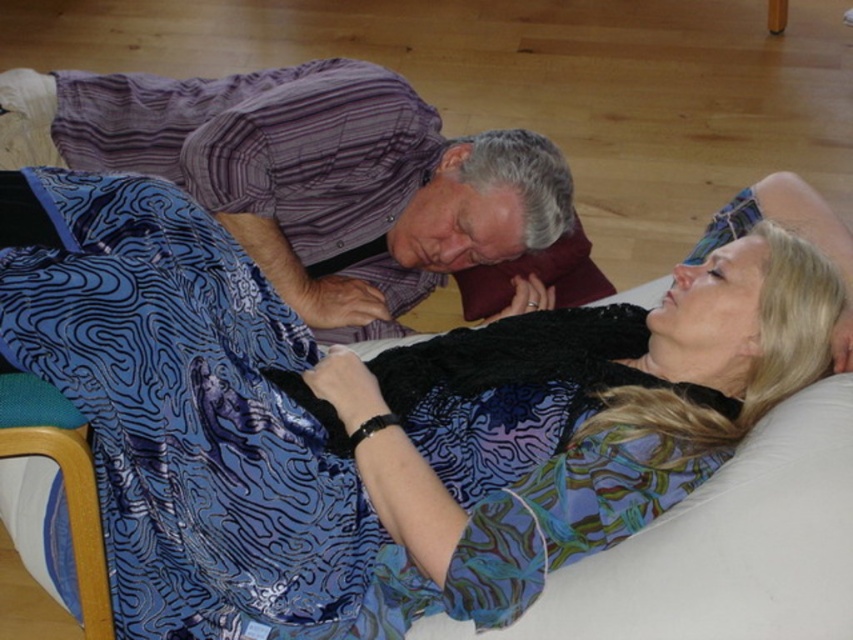
Question: Does silky blue dress at center have a lesser width compared to purple striped shirt at upper center?

Choices:
 (A) yes
 (B) no

Answer: (B)

Question: Among these points, which one is farthest from the camera?

Choices:
 (A) (94, 291)
 (B) (251, 115)

Answer: (B)

Question: Which of the following is the farthest from the observer?

Choices:
 (A) purple striped shirt at upper center
 (B) silky blue dress at center

Answer: (A)

Question: Is silky blue dress at center positioned in front of purple striped shirt at upper center?

Choices:
 (A) yes
 (B) no

Answer: (A)

Question: Which object is closer to the camera taking this photo?

Choices:
 (A) purple striped shirt at upper center
 (B) silky blue dress at center

Answer: (B)

Question: Is silky blue dress at center thinner than purple striped shirt at upper center?

Choices:
 (A) yes
 (B) no

Answer: (B)